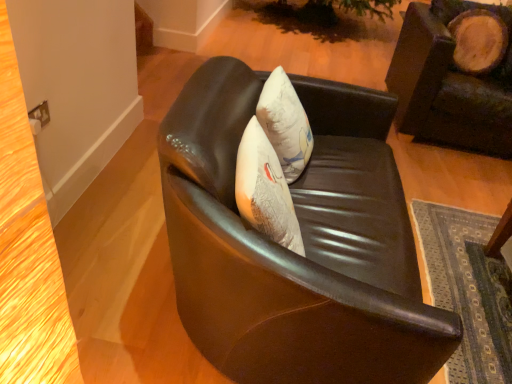
Question: Can we say shiny black leather chair at center, acting as the first chair starting from the front, lies outside leather cushion at upper right, arranged as the 2th chair when viewed from the front?

Choices:
 (A) no
 (B) yes

Answer: (B)

Question: From the image's perspective, would you say shiny black leather chair at center, which is counted as the second chair, starting from the back, is shown under leather cushion at upper right, which is counted as the second chair, starting from the left?

Choices:
 (A) yes
 (B) no

Answer: (A)

Question: Are shiny black leather chair at center, acting as the first chair starting from the front, and leather cushion at upper right, arranged as the 2th chair when viewed from the front, beside each other?

Choices:
 (A) yes
 (B) no

Answer: (B)

Question: Does shiny black leather chair at center, acting as the first chair starting from the front, have a greater width compared to leather cushion at upper right, which is the first chair in right-to-left order?

Choices:
 (A) yes
 (B) no

Answer: (B)

Question: From a real-world perspective, is shiny black leather chair at center, the second chair when ordered from right to left, physically below leather cushion at upper right, which is the first chair in right-to-left order?

Choices:
 (A) no
 (B) yes

Answer: (B)

Question: Does shiny black leather chair at center, acting as the first chair starting from the front, have a larger size compared to leather cushion at upper right, which appears as the first chair when viewed from the back?

Choices:
 (A) yes
 (B) no

Answer: (A)

Question: From a real-world perspective, is leather cushion at upper right, which is the first chair in right-to-left order, physically above shiny black leather chair at center, which is counted as the second chair, starting from the back?

Choices:
 (A) yes
 (B) no

Answer: (A)

Question: Considering the relative sizes of leather cushion at upper right, arranged as the 2th chair when viewed from the front, and shiny black leather chair at center, which is counted as the second chair, starting from the back, in the image provided, is leather cushion at upper right, arranged as the 2th chair when viewed from the front, thinner than shiny black leather chair at center, which is counted as the second chair, starting from the back,?

Choices:
 (A) no
 (B) yes

Answer: (A)

Question: Is leather cushion at upper right, arranged as the 2th chair when viewed from the front, touching shiny black leather chair at center, acting as the first chair starting from the front?

Choices:
 (A) no
 (B) yes

Answer: (A)

Question: Can you confirm if leather cushion at upper right, which appears as the first chair when viewed from the back, is smaller than shiny black leather chair at center, acting as the first chair starting from the front?

Choices:
 (A) yes
 (B) no

Answer: (A)

Question: Could you tell me if leather cushion at upper right, which is counted as the second chair, starting from the left, is turned towards shiny black leather chair at center, the second chair when ordered from right to left?

Choices:
 (A) yes
 (B) no

Answer: (B)

Question: From the image's perspective, is leather cushion at upper right, which appears as the first chair when viewed from the back, located above shiny black leather chair at center, acting as the first chair starting from the front?

Choices:
 (A) no
 (B) yes

Answer: (B)

Question: In terms of size, does shiny black leather chair at center, the second chair when ordered from right to left, appear bigger or smaller than leather cushion at upper right, which is counted as the second chair, starting from the left?

Choices:
 (A) big
 (B) small

Answer: (A)